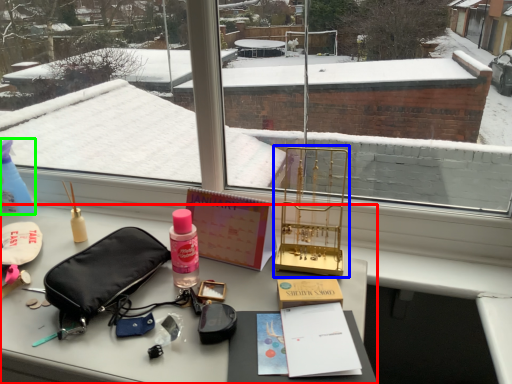
Question: Which object is the farthest from desk (highlighted by a red box)? Choose among these: bird cage (highlighted by a blue box) or bottle (highlighted by a green box).

Choices:
 (A) bird cage
 (B) bottle

Answer: (B)